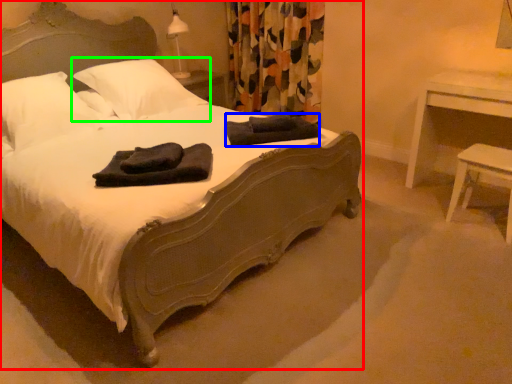
Question: Which object is positioned farthest from bed (highlighted by a red box)? Select from material (highlighted by a blue box) and pillow (highlighted by a green box).

Choices:
 (A) material
 (B) pillow

Answer: (B)